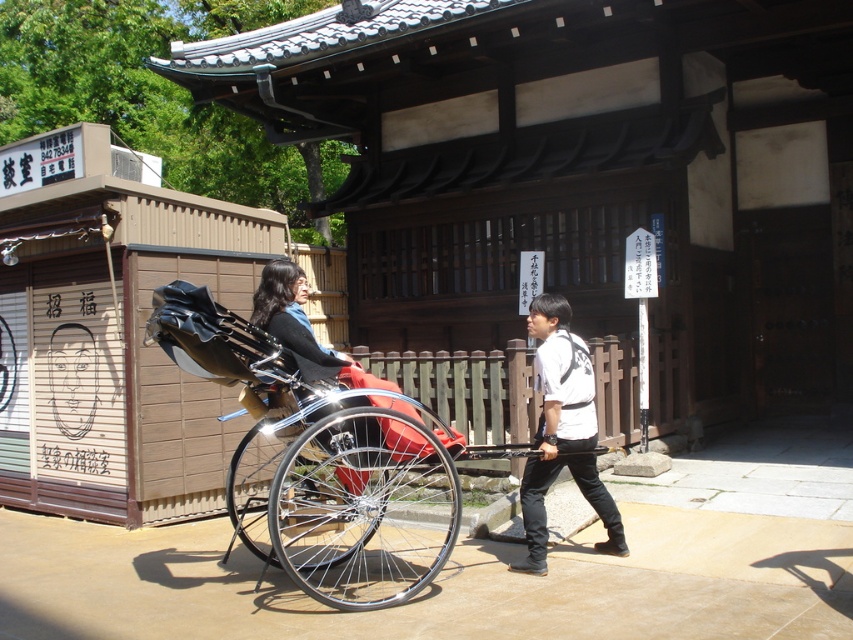
Looking at this image, is shiny chrome rickshaw at center below matte black rickshaw at center?

Yes.

Is point (202, 296) in front of point (264, 312)?

Yes, point (202, 296) is closer to viewer.

Identify the location of shiny chrome rickshaw at center. The width and height of the screenshot is (853, 640). (326, 460).

Who is positioned more to the right, white matte shirt at center or matte black rickshaw at center?

Positioned to the right is white matte shirt at center.

Is white matte shirt at center further to camera compared to matte black rickshaw at center?

Yes, it is behind matte black rickshaw at center.

Who is more distant from viewer, (546, 371) or (254, 321)?

Positioned behind is point (546, 371).

Where is `white matte shirt at center`? Image resolution: width=853 pixels, height=640 pixels. white matte shirt at center is located at coordinates (561, 433).

Does point (271, 408) come farther from viewer compared to point (543, 541)?

That is False.

Is the position of shiny chrome rickshaw at center more distant than that of white matte shirt at center?

That is False.

Is point (260, 488) farther from viewer compared to point (595, 435)?

Yes, point (260, 488) is farther from viewer.

Identify the location of shiny chrome rickshaw at center. This screenshot has width=853, height=640. (326, 460).